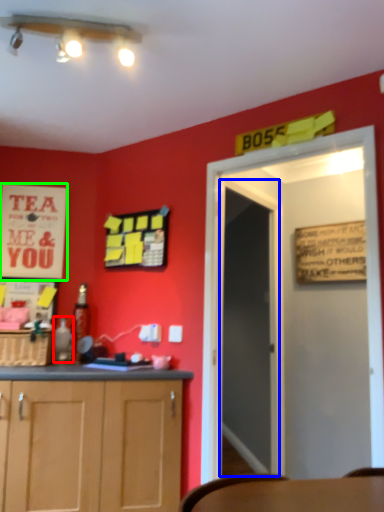
Question: Which object is the closest to the bottle (highlighted by a red box)? Choose among these: glass door (highlighted by a blue box) or poster (highlighted by a green box).

Choices:
 (A) glass door
 (B) poster

Answer: (B)